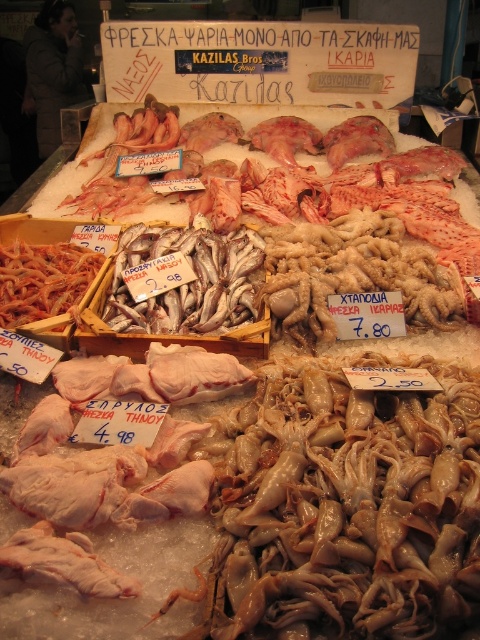
The width and height of the screenshot is (480, 640). What do you see at coordinates (187, 280) in the screenshot?
I see `white fish at center` at bounding box center [187, 280].

Is white fish at center positioned behind white raw squid at center?

Yes.

Who is more distant from viewer, (192, 307) or (74, 301)?

Point (74, 301)

I want to click on white fish at center, so click(187, 280).